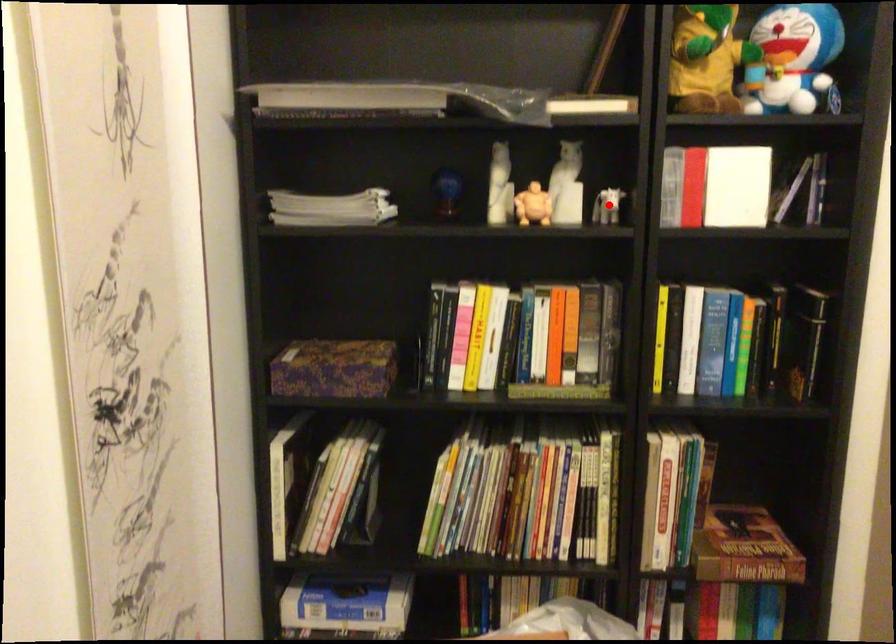
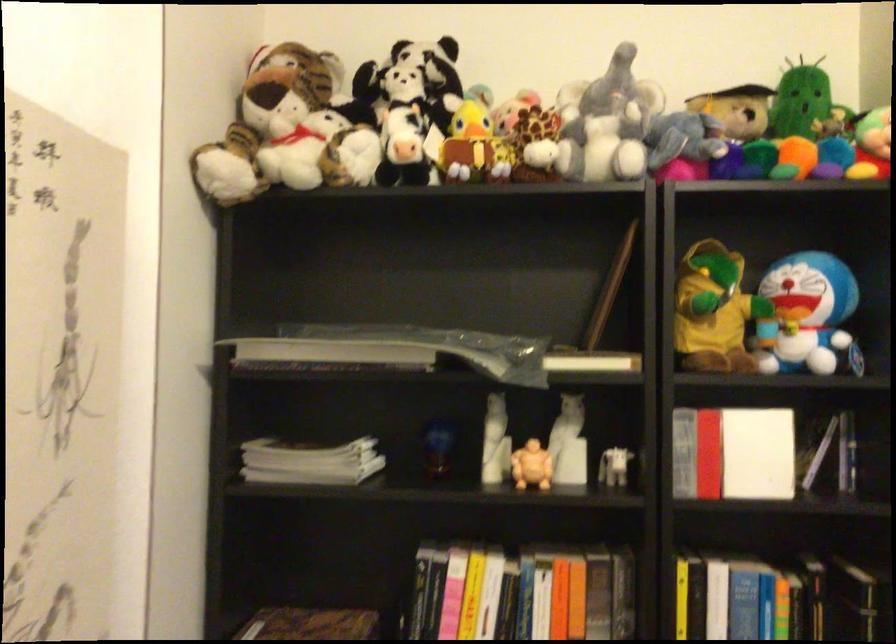
The point at the highlighted location is marked in the first image. Where is the corresponding point in the second image?

(615, 468)